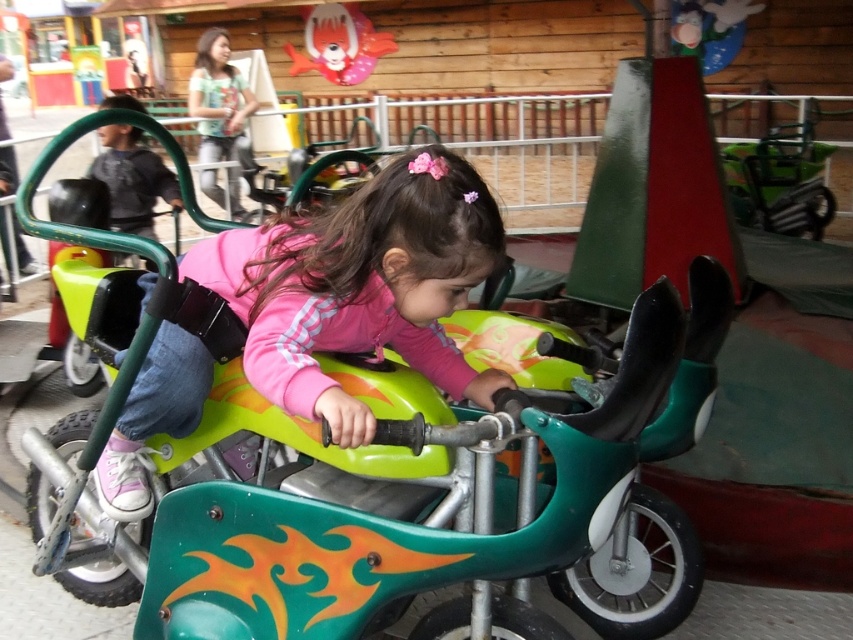
Question: Which object appears closest to the camera in this image?

Choices:
 (A) matte green motorcycle at center
 (B) shiny plastic balloon at upper center

Answer: (A)

Question: Is matte green motorcycle at center to the left of shiny plastic balloon at upper center from the viewer's perspective?

Choices:
 (A) no
 (B) yes

Answer: (A)

Question: Is matte green motorcycle at center to the left of shiny plastic balloon at upper center from the viewer's perspective?

Choices:
 (A) yes
 (B) no

Answer: (B)

Question: Considering the relative positions of matte green motorcycle at center and shiny plastic balloon at upper center in the image provided, where is matte green motorcycle at center located with respect to shiny plastic balloon at upper center?

Choices:
 (A) right
 (B) left

Answer: (A)